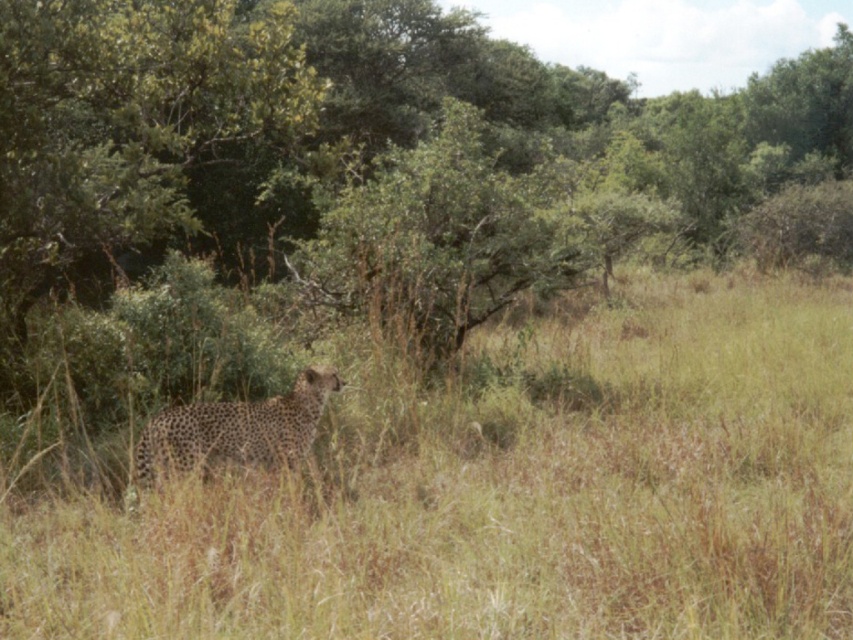
Question: Does brown dry grass at center appear over green leafy tree at center?

Choices:
 (A) no
 (B) yes

Answer: (A)

Question: Is the position of brown dry grass at center more distant than that of green leafy tree at center?

Choices:
 (A) no
 (B) yes

Answer: (A)

Question: Which object is the closest to the brown dry grass at center?

Choices:
 (A) green leafy tree at center
 (B) spotted fur cheetah at center

Answer: (B)

Question: Does brown dry grass at center appear over green leafy tree at center?

Choices:
 (A) no
 (B) yes

Answer: (A)

Question: Which point is farther to the camera?

Choices:
 (A) green leafy tree at center
 (B) brown dry grass at center

Answer: (A)

Question: Which object is farther from the camera taking this photo?

Choices:
 (A) spotted fur cheetah at center
 (B) brown dry grass at center

Answer: (A)